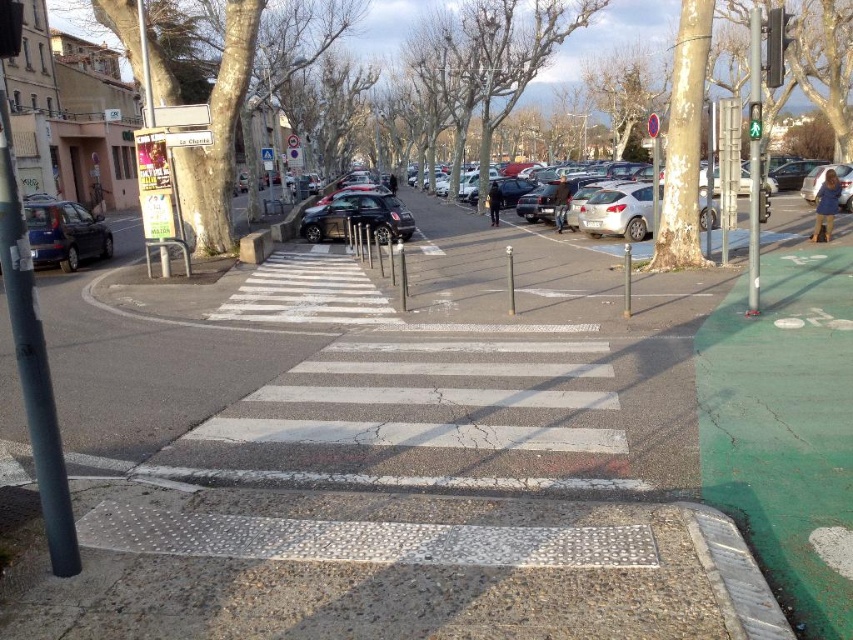
Between matte black car at left and green glass pedestrian signal at upper center, which one is positioned lower?

Positioned lower is matte black car at left.

Find the location of `matte black car at left`. matte black car at left is located at coordinates (64, 234).

Describe the element at coordinates (64, 234) in the screenshot. I see `matte black car at left` at that location.

Locate an element on the screen. This screenshot has height=640, width=853. matte black car at left is located at coordinates (64, 234).

Does metallic rectangular traffic light at upper right appear on the left side of green glass pedestrian signal at upper center?

Incorrect, metallic rectangular traffic light at upper right is not on the left side of green glass pedestrian signal at upper center.

Is point (784, 22) less distant than point (753, 138)?

That is True.

The image size is (853, 640). In order to click on metallic rectangular traffic light at upper right in this screenshot , I will do `click(775, 45)`.

Between point (804, 204) and point (776, 49), which one is positioned in front?

Point (776, 49) is more forward.

Describe the element at coordinates (442, 214) in the screenshot. I see `silver metallic sedan at center` at that location.

Which is behind, point (424, 227) or point (770, 16)?

The point (424, 227) is more distant.

At what (x,y) coordinates should I click in order to perform the action: click on silver metallic sedan at center. Please return your answer as a coordinate pair (x, y). The image size is (853, 640). Looking at the image, I should click on (442, 214).